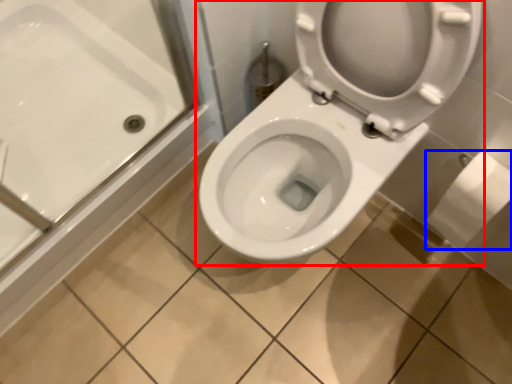
Question: Among these objects, which one is farthest to the camera, toilet (highlighted by a red box) or toilet paper (highlighted by a blue box)?

Choices:
 (A) toilet
 (B) toilet paper

Answer: (B)